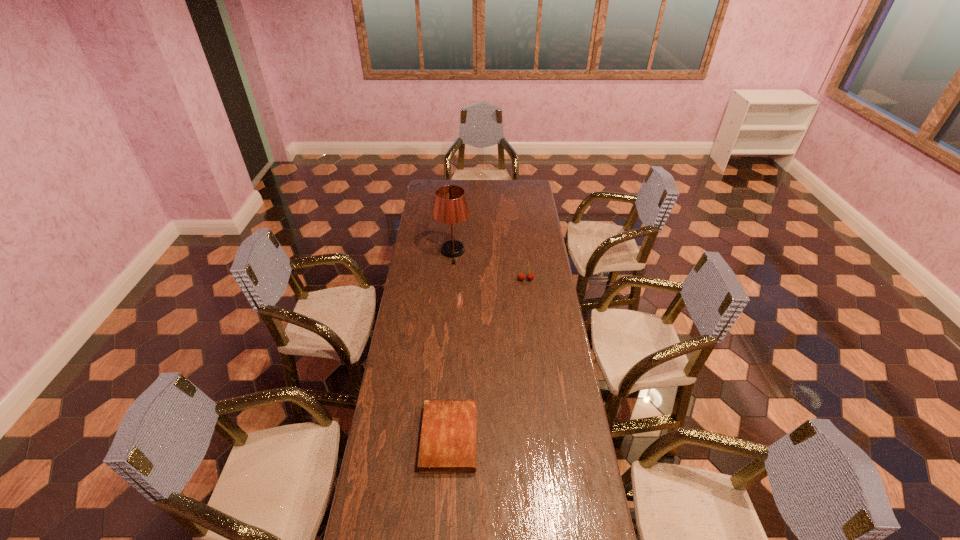
Find the location of a particular element. This screenshot has width=960, height=540. free space between the cherry and the tallest object is located at coordinates (490, 266).

This screenshot has width=960, height=540. I want to click on free space between the nearest object and the cherry, so click(x=488, y=359).

Identify which object is the nearest to the Bible. Please provide its 2D coordinates. Your answer should be formatted as a tuple, i.e. [(x, y)], where the tuple contains the x and y coordinates of a point satisfying the conditions above.

[(521, 276)]

You are a GUI agent. You are given a task and a screenshot of the screen. Output one action in this format:
    pyautogui.click(x=<x>, y=<y>)
    Task: Click on the object that stands as the second closest to the Bible
    
    Given the screenshot: What is the action you would take?
    pyautogui.click(x=450, y=206)

The width and height of the screenshot is (960, 540). Identify the location of vacant position in the image that satisfies the following two spatial constraints: 1. on the surface of the rightmost object; 2. on the spine side of the shortest object. (544, 437).